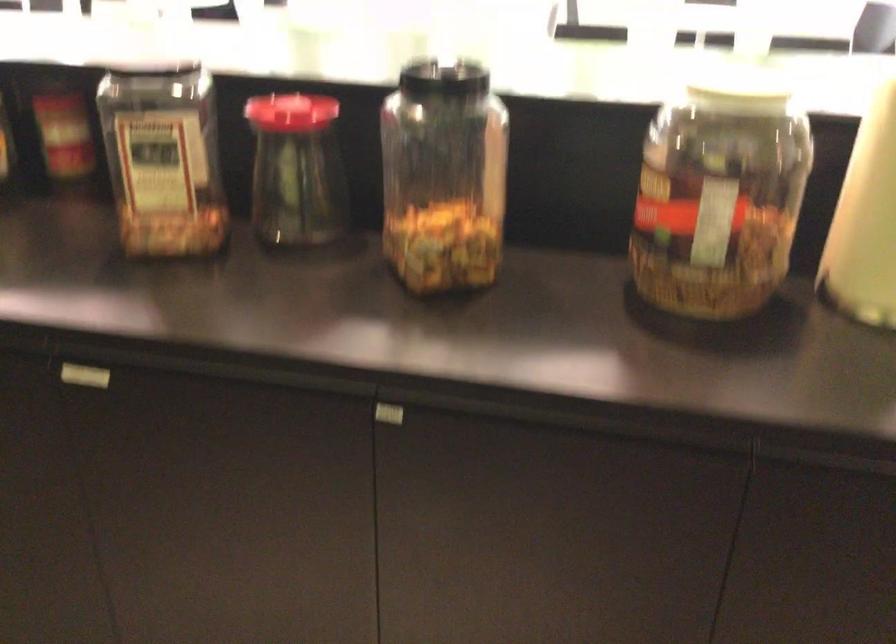
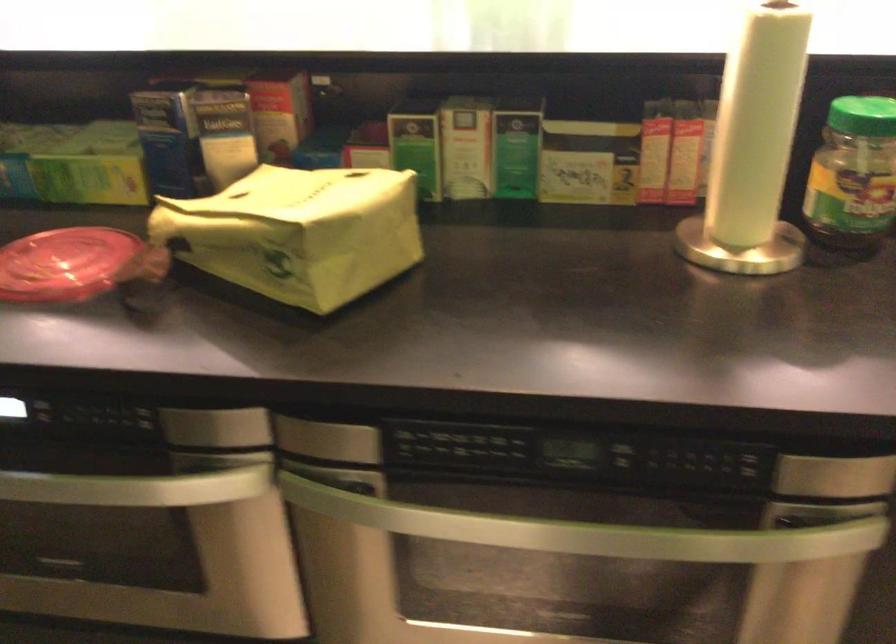
Question: In a continuous first-person perspective shot, in which direction is the camera moving?

Choices:
 (A) Left
 (B) Right
 (C) Forward
 (D) Backward

Answer: (A)